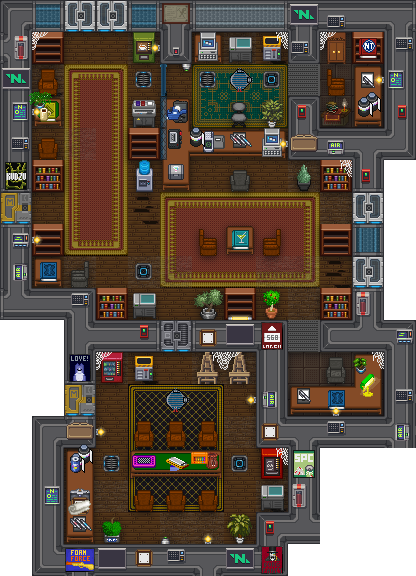
Where is `full bookshelves`? full bookshelves is located at coordinates (39, 170), (109, 305), (331, 181), (338, 298).